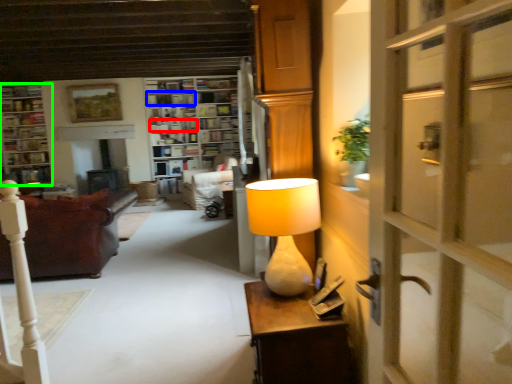
Question: Which object is positioned farthest from book (highlighted by a red box)? Select from shelf (highlighted by a blue box) and cabinetry (highlighted by a green box).

Choices:
 (A) shelf
 (B) cabinetry

Answer: (B)